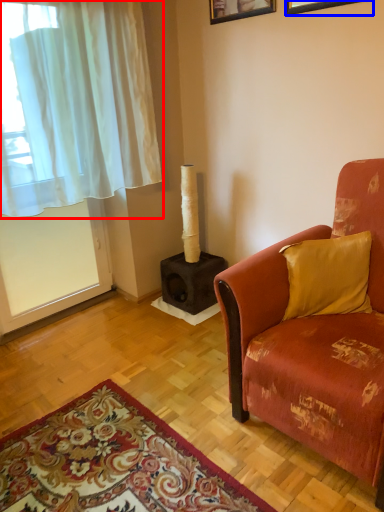
Question: Among these objects, which one is farthest to the camera, curtain (highlighted by a red box) or picture frame (highlighted by a blue box)?

Choices:
 (A) curtain
 (B) picture frame

Answer: (B)